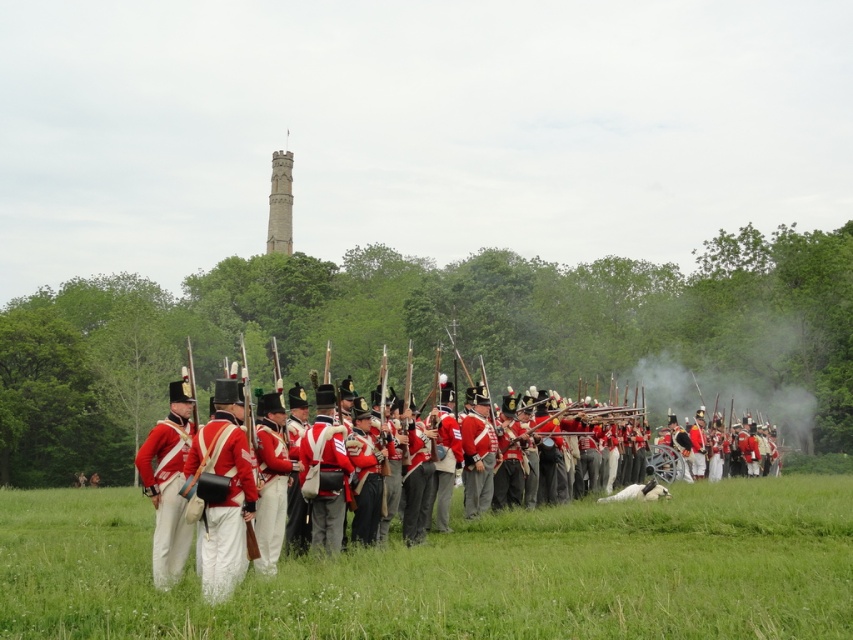
Question: Which object is positioned farthest from the green grass at center?

Choices:
 (A) red wool uniform at left
 (B) red cotton uniform at center

Answer: (A)

Question: Which of these objects is positioned closest to the red wool uniform at left?

Choices:
 (A) green grass at center
 (B) red cotton uniform at center

Answer: (B)

Question: Does red cotton uniform at center appear under red wool uniform at left?

Choices:
 (A) yes
 (B) no

Answer: (A)

Question: Which object appears farthest from the camera in this image?

Choices:
 (A) red cotton uniform at center
 (B) red wool uniform at left

Answer: (B)

Question: Is the position of green grass at center more distant than that of red wool uniform at left?

Choices:
 (A) yes
 (B) no

Answer: (B)

Question: From the image, what is the correct spatial relationship of green grass at center in relation to red cotton uniform at center?

Choices:
 (A) right
 (B) left

Answer: (B)